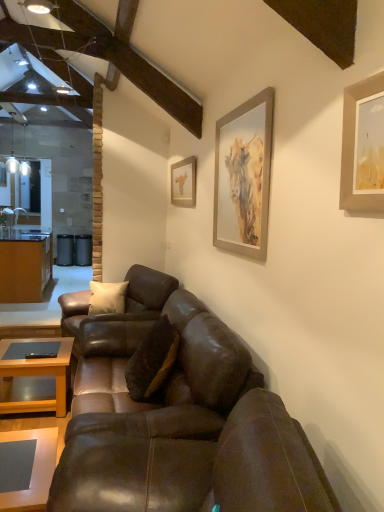
Question: Which direction should I rotate to face brown leather couch at center, positioned as the 3th studio couch in front-to-back order, — up or down?

Choices:
 (A) up
 (B) down

Answer: (B)

Question: Is brown leather couch at center, acting as the 2th studio couch starting from the back, at the left side of matte gray coffee table at lower left, the 1th coffee table positioned from the front?

Choices:
 (A) yes
 (B) no

Answer: (B)

Question: Is brown leather couch at center, acting as the second studio couch starting from the front, taller than matte gray coffee table at lower left, the 2th coffee table from the back?

Choices:
 (A) no
 (B) yes

Answer: (B)

Question: Is brown leather couch at center, acting as the 2th studio couch starting from the back, positioned behind matte gray coffee table at lower left, the 2th coffee table from the back?

Choices:
 (A) yes
 (B) no

Answer: (A)

Question: Does brown leather couch at center, acting as the 2th studio couch starting from the back, have a smaller size compared to matte gray coffee table at lower left, the 1th coffee table positioned from the front?

Choices:
 (A) no
 (B) yes

Answer: (A)

Question: Is brown leather couch at center, acting as the 2th studio couch starting from the back, next to matte gray coffee table at lower left, the 1th coffee table in the right-to-left sequence, and touching it?

Choices:
 (A) yes
 (B) no

Answer: (B)

Question: From a real-world perspective, is brown leather couch at center, acting as the 2th studio couch starting from the back, physically below matte gray coffee table at lower left, the 2th coffee table when ordered from left to right?

Choices:
 (A) no
 (B) yes

Answer: (A)

Question: Is matte gray coffee table at lower left, the 2th coffee table from the back, wider than brown suede pillow at center?

Choices:
 (A) no
 (B) yes

Answer: (A)

Question: From the image's perspective, is matte gray coffee table at lower left, the 1th coffee table positioned from the front, beneath brown suede pillow at center?

Choices:
 (A) yes
 (B) no

Answer: (A)

Question: Can you confirm if matte gray coffee table at lower left, the 2th coffee table when ordered from left to right, is smaller than brown suede pillow at center?

Choices:
 (A) no
 (B) yes

Answer: (B)

Question: Is matte gray coffee table at lower left, the 1th coffee table in the right-to-left sequence, located outside brown suede pillow at center?

Choices:
 (A) no
 (B) yes

Answer: (B)

Question: Could brown suede pillow at center be considered to be inside matte gray coffee table at lower left, the 1th coffee table in the right-to-left sequence?

Choices:
 (A) yes
 (B) no

Answer: (B)

Question: From a real-world perspective, is matte gray coffee table at lower left, the 1th coffee table in the right-to-left sequence, under brown suede pillow at center?

Choices:
 (A) no
 (B) yes

Answer: (B)

Question: Is matte gold picture frame at upper center, arranged as the first picture frame when viewed from the back, to the left of brown suede pillow at center from the viewer's perspective?

Choices:
 (A) no
 (B) yes

Answer: (A)